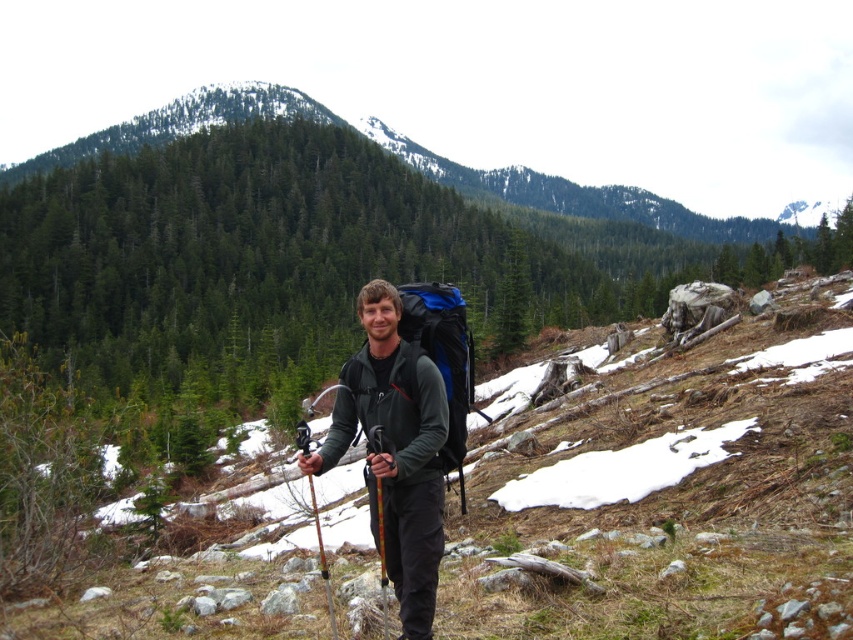
Between matte black backpack at center and matte black jacket at center, which one has more height?

matte black backpack at center

From the picture: Is matte black backpack at center above matte black jacket at center?

No, matte black backpack at center is not above matte black jacket at center.

The image size is (853, 640). Find the location of `matte black backpack at center`. matte black backpack at center is located at coordinates (669, 502).

This screenshot has height=640, width=853. What are the coordinates of `matte black backpack at center` in the screenshot? It's located at (669, 502).

In the scene shown: Does matte black backpack at center appear on the right side of green forested mountain at upper center?

Incorrect, matte black backpack at center is not on the right side of green forested mountain at upper center.

Is matte black backpack at center smaller than green forested mountain at upper center?

Yes.

Which is behind, point (222, 564) or point (192, 116)?

Point (192, 116)

Locate an element on the screen. Image resolution: width=853 pixels, height=640 pixels. matte black backpack at center is located at coordinates (669, 502).

This screenshot has width=853, height=640. I want to click on matte black jacket at center, so click(393, 451).

Can you confirm if matte black jacket at center is positioned to the left of wooden textured ski pole at center?

Correct, you'll find matte black jacket at center to the left of wooden textured ski pole at center.

What do you see at coordinates (393, 451) in the screenshot? I see `matte black jacket at center` at bounding box center [393, 451].

Image resolution: width=853 pixels, height=640 pixels. I want to click on matte black jacket at center, so click(x=393, y=451).